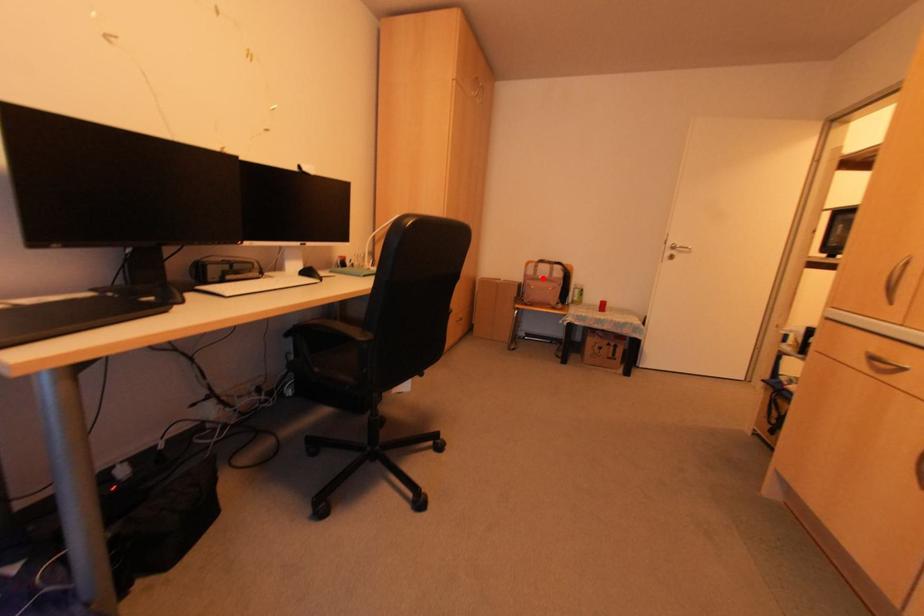
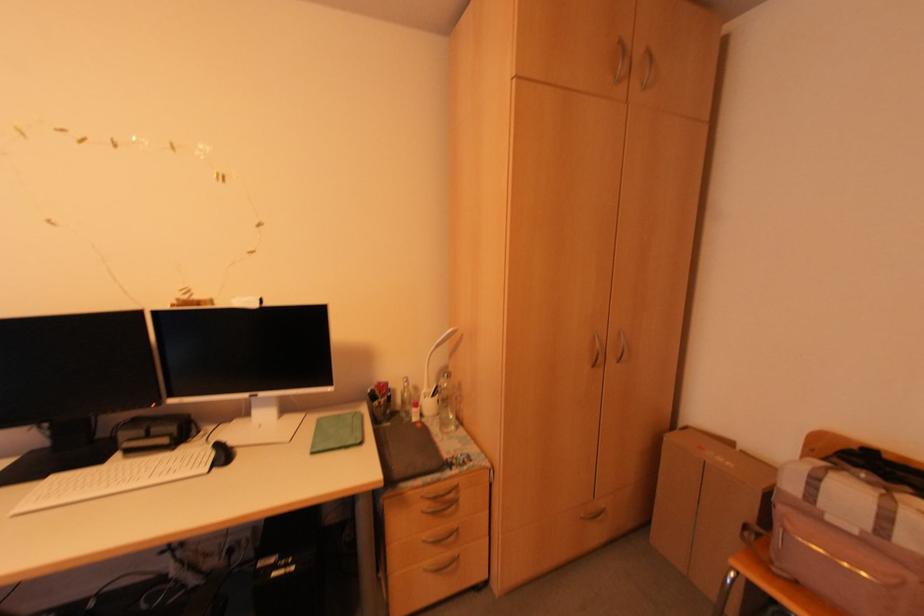
Find the pixel in the second image that matches the highlighted location in the first image.

(854, 532)